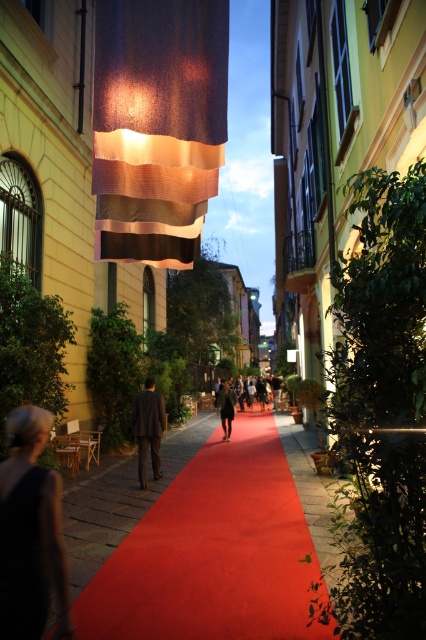
Is smooth red carpet at center taller than brown leather jacket at center?

Yes, smooth red carpet at center is taller than brown leather jacket at center.

Where is `smooth red carpet at center`? smooth red carpet at center is located at coordinates [218, 545].

Who is taller, dark brown suit at center or brown leather jacket at center?

With more height is dark brown suit at center.

The width and height of the screenshot is (426, 640). In order to click on dark brown suit at center in this screenshot , I will do `click(147, 428)`.

Can you confirm if smooth red carpet at center is positioned below dark brown suit at center?

Yes.

Does smooth red carpet at center lie in front of dark brown suit at center?

Yes, it is.

Is point (109, 496) positioned after point (152, 410)?

No, (109, 496) is closer to viewer.

The height and width of the screenshot is (640, 426). What are the coordinates of `smooth red carpet at center` in the screenshot? It's located at (218, 545).